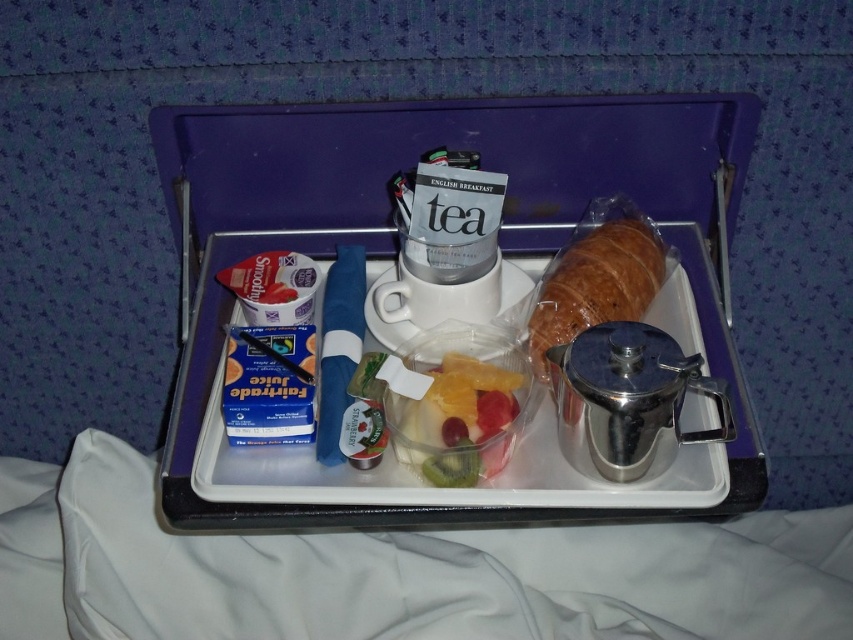
Which is in front, point (456, 413) or point (579, 291)?

Positioned in front is point (456, 413).

Which of these two, translucent plastic container of fruit salad at center or golden brown croissant at right, stands shorter?

translucent plastic container of fruit salad at center is shorter.

Does point (440, 484) come farther from viewer compared to point (631, 225)?

No, (440, 484) is in front of (631, 225).

Find the location of `translucent plastic container of fruit salad at center`. translucent plastic container of fruit salad at center is located at coordinates (456, 419).

Is metallic silver tray at center shorter than golden brown croissant at right?

No.

Does metallic silver tray at center have a smaller size compared to golden brown croissant at right?

No.

This screenshot has width=853, height=640. Identify the location of metallic silver tray at center. (397, 241).

Looking at this image, can you confirm if metallic silver tray at center is bigger than translucent plastic container of fruit salad at center?

Correct, metallic silver tray at center is larger in size than translucent plastic container of fruit salad at center.

Can you confirm if metallic silver tray at center is positioned to the left of translucent plastic container of fruit salad at center?

In fact, metallic silver tray at center is to the right of translucent plastic container of fruit salad at center.

Which is behind, point (694, 102) or point (448, 467)?

Point (694, 102)

Where is `metallic silver tray at center`? metallic silver tray at center is located at coordinates (397, 241).